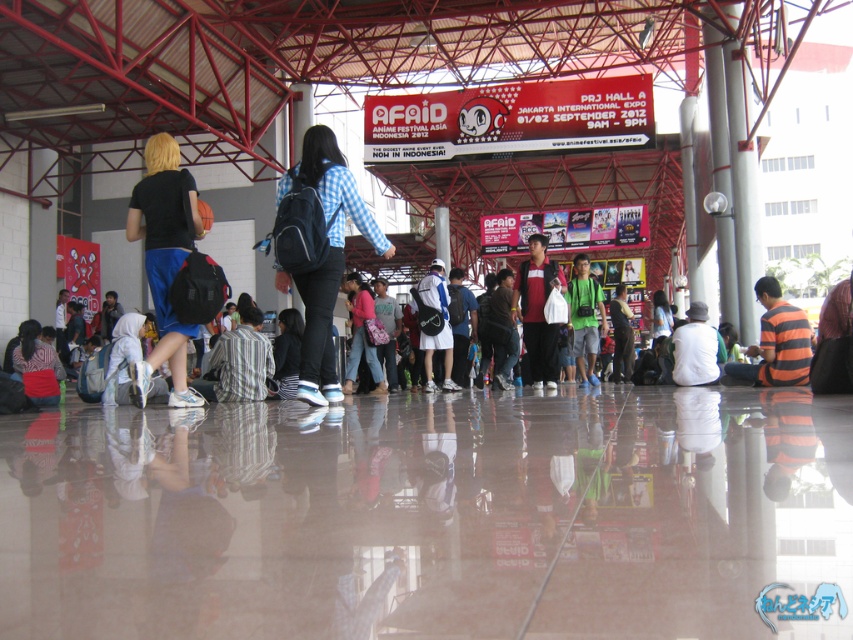
You are an event organizer who needs to place a 4 feet wide table between the white fabric backpack at center and the pink fabric bag at center. Is there enough space?

The white fabric backpack at center is 3.50 feet away from the pink fabric bag at center. Since the table is 4 feet wide, there isn t enough space to place it between them.

You are an attendee at the convention center and you see the white fabric backpack at center and the pink fabric bag at center. Which one is taller?

The white fabric backpack at center is much taller than the pink fabric bag at center.